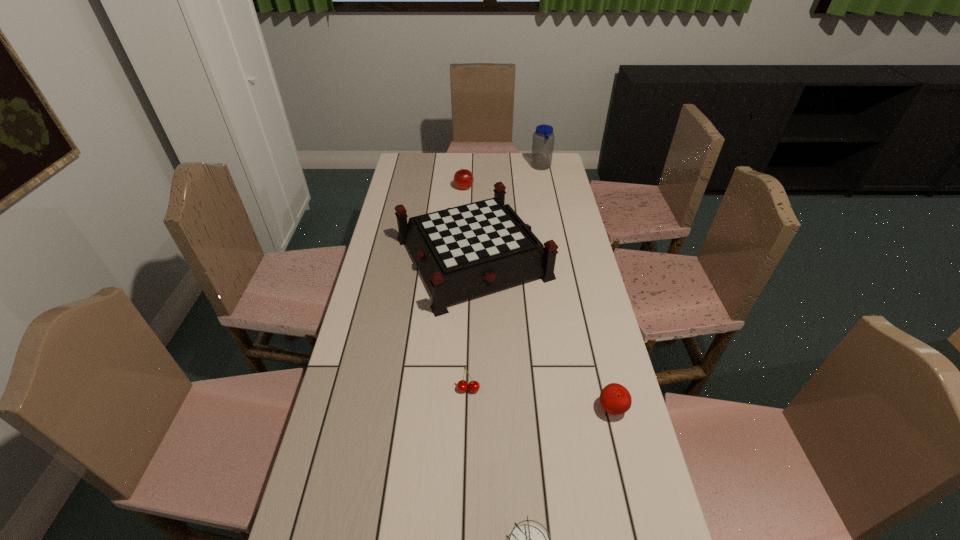
Identify the location of object that is the fifth closest to the water bottle. This screenshot has height=540, width=960. (528, 539).

You are a GUI agent. You are given a task and a screenshot of the screen. Output one action in this format:
    pyautogui.click(x=<x>, y=<y>)
    Task: Click on the vacant region that satisfies the following two spatial constraints: 1. with a carrying loop on the side of the water bottle; 2. on the front side of the checkerboard
    
    Given the screenshot: What is the action you would take?
    pyautogui.click(x=560, y=258)

At what (x,y) coordinates should I click in order to perform the action: click on free point that satisfies the following two spatial constraints: 1. with a carrying loop on the side of the farthest object; 2. on the left side of the nearer apple. Please return your answer as a coordinate pair (x, y). This screenshot has height=540, width=960. Looking at the image, I should click on (590, 409).